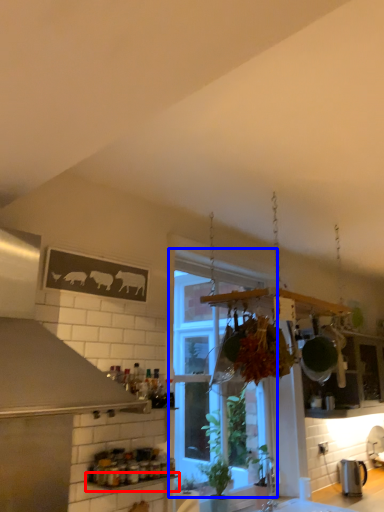
Question: Which of the following is the farthest to the observer, window sill (highlighted by a red box) or window (highlighted by a blue box)?

Choices:
 (A) window sill
 (B) window

Answer: (B)